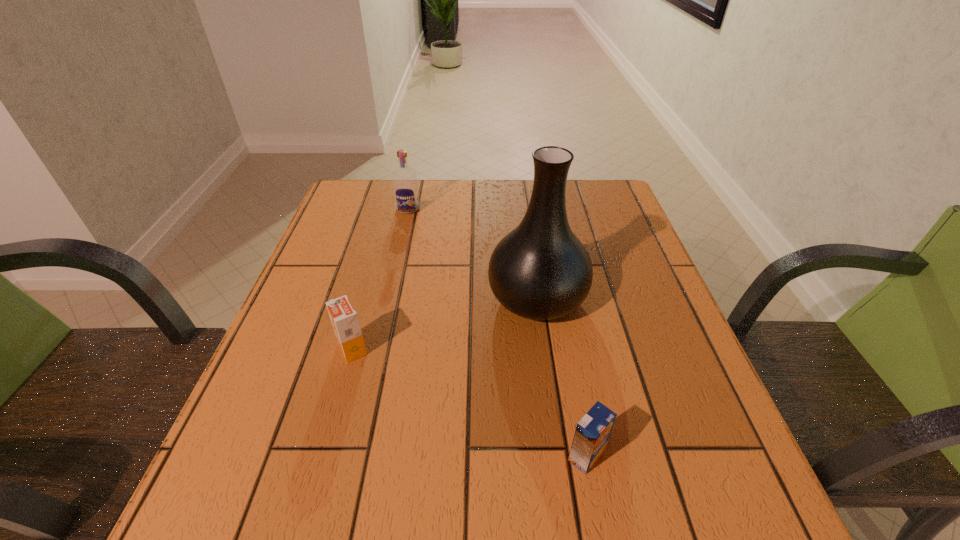
Where is `the third nearest object`? The width and height of the screenshot is (960, 540). the third nearest object is located at coordinates (540, 270).

I want to click on vase, so click(x=540, y=270).

The height and width of the screenshot is (540, 960). What are the coordinates of `vodka` in the screenshot? It's located at (404, 179).

Locate an element on the screen. the farthest object is located at coordinates (404, 179).

Find the location of `the farther orange_juice`. the farther orange_juice is located at coordinates pyautogui.click(x=344, y=319).

This screenshot has width=960, height=540. Identify the location of the second nearest object. (344, 319).

Identify the location of the nearest object. (592, 432).

Where is `the nearer orange_juice`? The width and height of the screenshot is (960, 540). the nearer orange_juice is located at coordinates (592, 432).

Locate an element on the screen. free space located 0.050m on the right of the vase is located at coordinates [x=609, y=298].

Where is `vacant space located on the label of the farthest object`? This screenshot has height=540, width=960. vacant space located on the label of the farthest object is located at coordinates (398, 253).